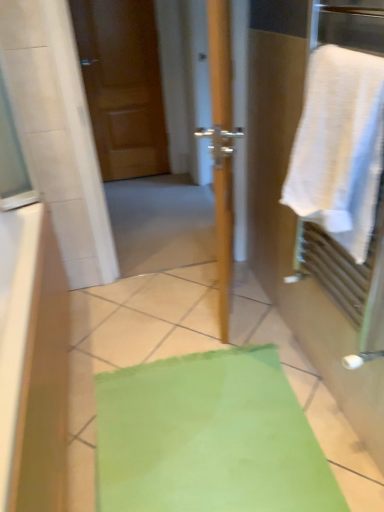
Question: Can you confirm if wooden door at center is wider than matte wood door at upper left?

Choices:
 (A) no
 (B) yes

Answer: (B)

Question: From the image's perspective, does wooden door at center appear higher than matte wood door at upper left?

Choices:
 (A) yes
 (B) no

Answer: (B)

Question: From a real-world perspective, is wooden door at center below matte wood door at upper left?

Choices:
 (A) no
 (B) yes

Answer: (B)

Question: Are wooden door at center and matte wood door at upper left located far from each other?

Choices:
 (A) yes
 (B) no

Answer: (B)

Question: Considering the relative positions of wooden door at center and matte wood door at upper left in the image provided, is wooden door at center to the right of matte wood door at upper left from the viewer's perspective?

Choices:
 (A) yes
 (B) no

Answer: (A)

Question: Relative to matte wood door at upper left, is white cotton towel at right in front or behind?

Choices:
 (A) behind
 (B) front

Answer: (B)

Question: Is white cotton towel at right inside or outside of matte wood door at upper left?

Choices:
 (A) outside
 (B) inside

Answer: (A)

Question: Based on their sizes in the image, would you say white cotton towel at right is bigger or smaller than matte wood door at upper left?

Choices:
 (A) small
 (B) big

Answer: (A)

Question: Visually, is white cotton towel at right positioned to the left or to the right of matte wood door at upper left?

Choices:
 (A) right
 (B) left

Answer: (A)

Question: In the image, is white cotton towel at right positioned in front of or behind wooden door at center?

Choices:
 (A) behind
 (B) front

Answer: (B)

Question: From a real-world perspective, is white cotton towel at right physically located above or below wooden door at center?

Choices:
 (A) below
 (B) above

Answer: (B)

Question: Looking at their shapes, would you say white cotton towel at right is wider or thinner than wooden door at center?

Choices:
 (A) thin
 (B) wide

Answer: (B)

Question: From the image's perspective, relative to wooden door at center, is white cotton towel at right above or below?

Choices:
 (A) below
 (B) above

Answer: (A)

Question: Considering the positions of point (124, 53) and point (286, 179), is point (124, 53) closer or farther from the camera than point (286, 179)?

Choices:
 (A) closer
 (B) farther

Answer: (B)

Question: In the image, is matte wood door at upper left positioned in front of or behind white cotton towel at right?

Choices:
 (A) front
 (B) behind

Answer: (B)